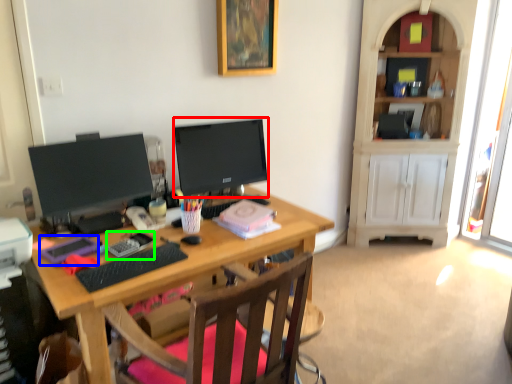
Question: Which is farther away from television (highlighted by a red box)? stationery (highlighted by a blue box) or stationery (highlighted by a green box)?

Choices:
 (A) stationery
 (B) stationery

Answer: (A)